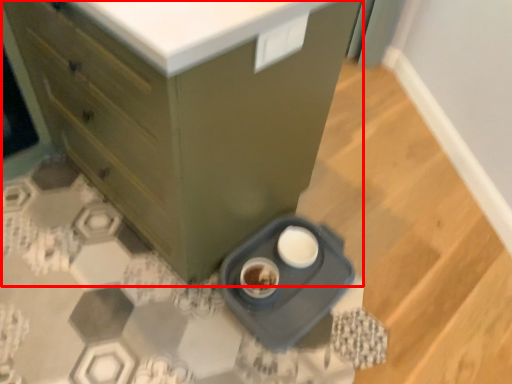
Question: From the image's perspective, where is chest of drawers (annotated by the red box) located in relation to appliance in the image?

Choices:
 (A) above
 (B) below

Answer: (A)